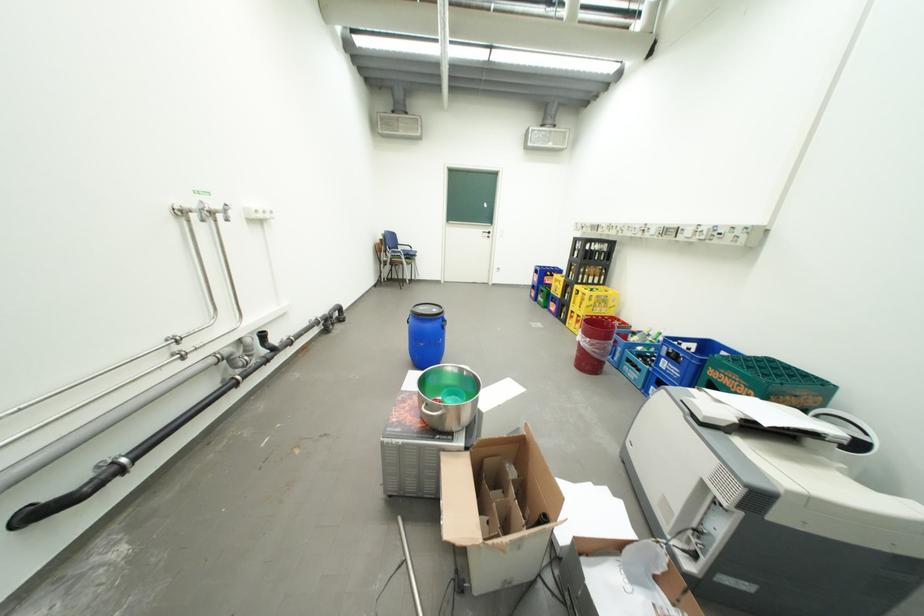
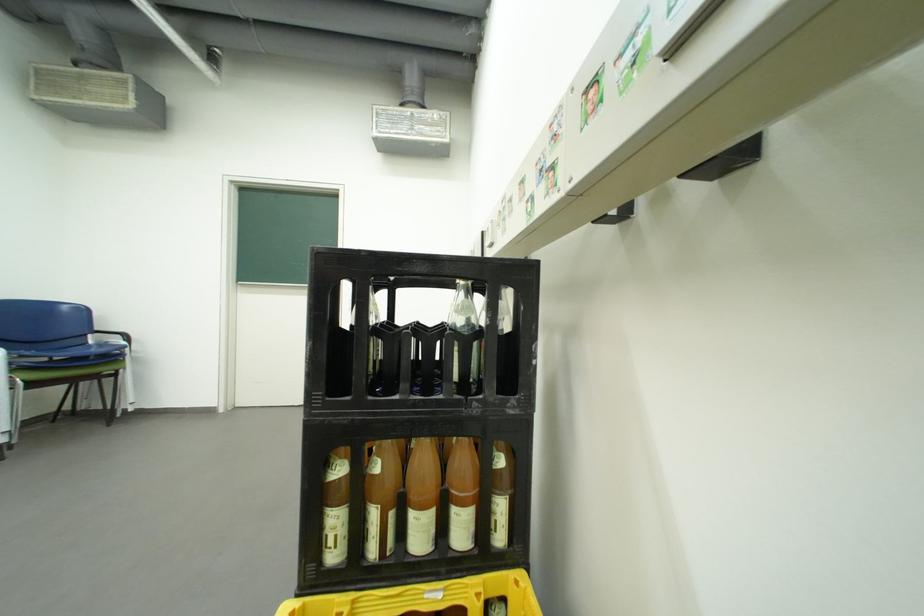
In a continuous first-person perspective shot, in which direction is the camera moving?

The cameraman walked toward right, forward.